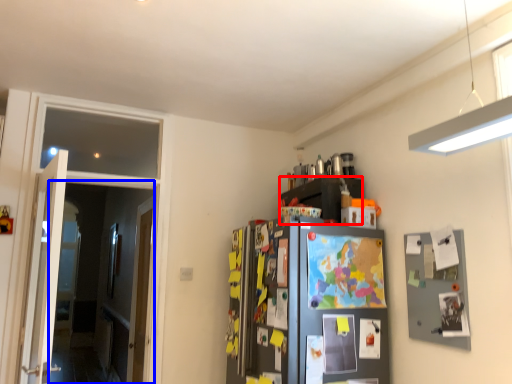
Question: Which point is closer to the camera, cabinetry (highlighted by a red box) or glass door (highlighted by a blue box)?

Choices:
 (A) cabinetry
 (B) glass door

Answer: (B)